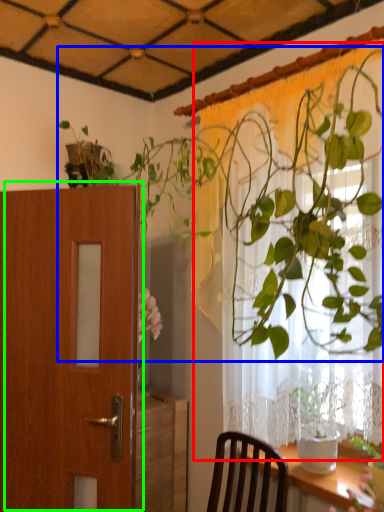
Question: Which object is positioned closest to curtain (highlighted by a red box)? Select from houseplant (highlighted by a blue box) and door (highlighted by a green box).

Choices:
 (A) houseplant
 (B) door

Answer: (A)